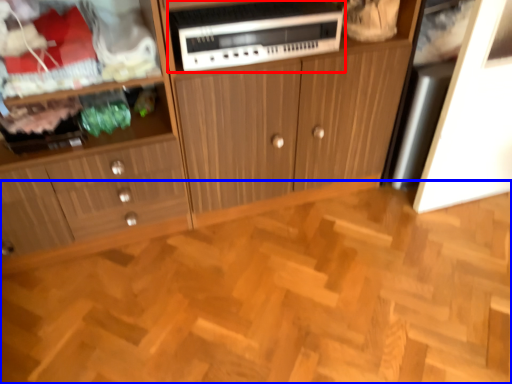
Question: Which of the following is the farthest to the observer, home appliance (highlighted by a red box) or hardwood (highlighted by a blue box)?

Choices:
 (A) home appliance
 (B) hardwood

Answer: (A)